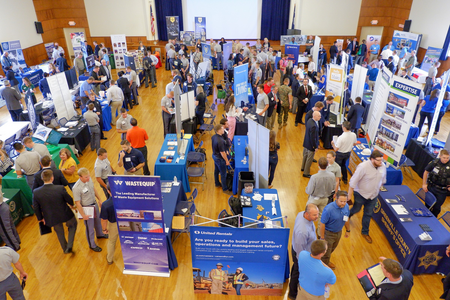
At what (x,y) coordinates should I click in order to perform the action: click on blue table cloth. Please return your answer as a coordinate pair (x, y). The image size is (450, 300). Looking at the image, I should click on (105, 115), (409, 223), (413, 132).